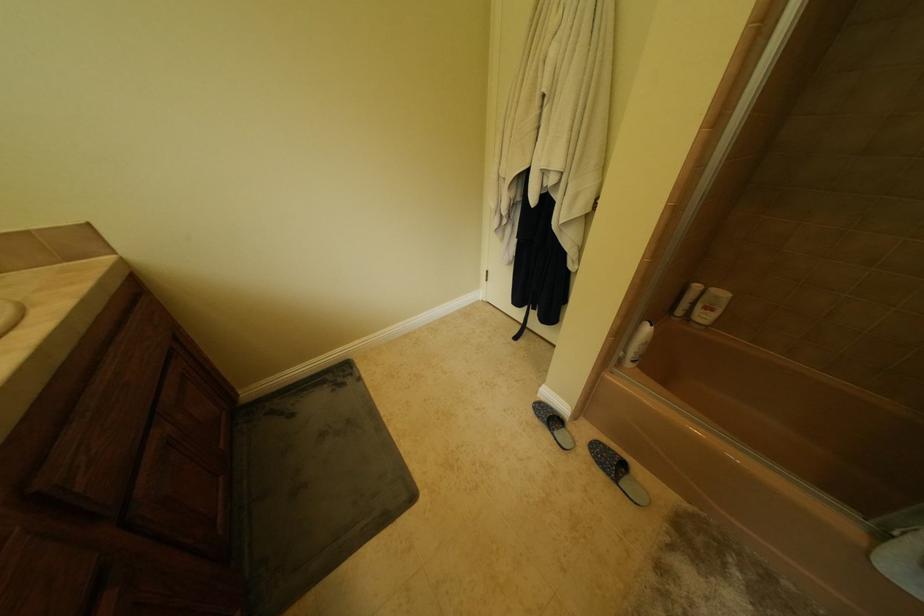
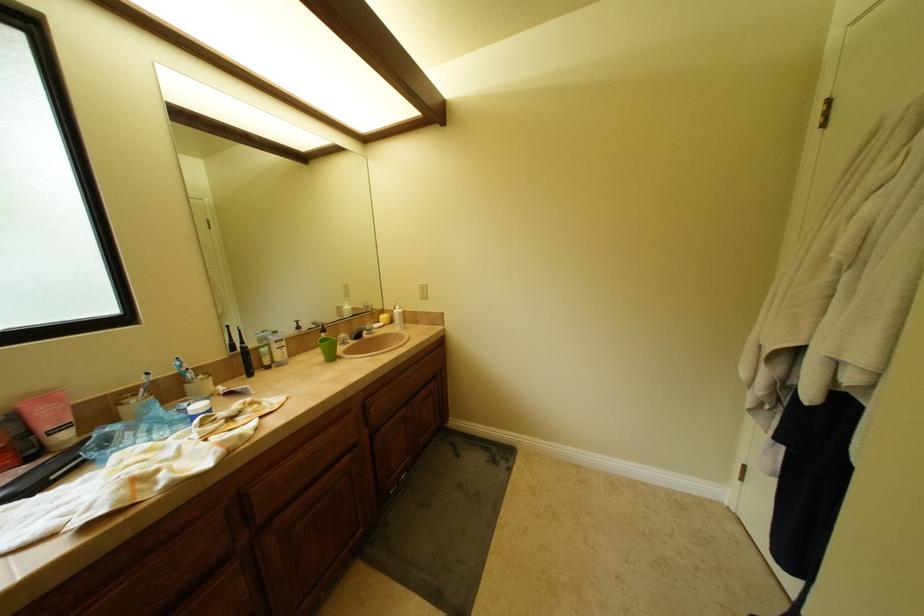
Question: The images are taken continuously from a first-person perspective. In which direction is your viewpoint rotating?

Choices:
 (A) Left
 (B) Right
 (C) Up
 (D) Down

Answer: (A)